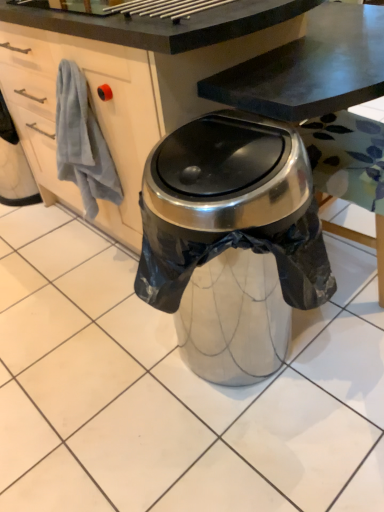
Question: Should I look upward or downward to see white matte cabinet at left?

Choices:
 (A) up
 (B) down

Answer: (A)

Question: Would you say white matte cabinet at left contains metallic trash can at center?

Choices:
 (A) yes
 (B) no

Answer: (B)

Question: Can you confirm if white matte cabinet at left is positioned to the right of metallic trash can at center?

Choices:
 (A) yes
 (B) no

Answer: (B)

Question: From a real-world perspective, is white matte cabinet at left beneath metallic trash can at center?

Choices:
 (A) yes
 (B) no

Answer: (B)

Question: Can you confirm if white matte cabinet at left is taller than metallic trash can at center?

Choices:
 (A) no
 (B) yes

Answer: (A)

Question: Is white matte cabinet at left shorter than metallic trash can at center?

Choices:
 (A) no
 (B) yes

Answer: (B)

Question: Is white matte cabinet at left aimed at metallic trash can at center?

Choices:
 (A) yes
 (B) no

Answer: (B)

Question: From the image's perspective, does metallic trash can at center appear lower than white matte cabinet at left?

Choices:
 (A) no
 (B) yes

Answer: (B)

Question: Would you say metallic trash can at center is outside white matte cabinet at left?

Choices:
 (A) yes
 (B) no

Answer: (A)

Question: Considering the relative sizes of metallic trash can at center and white matte cabinet at left in the image provided, is metallic trash can at center taller than white matte cabinet at left?

Choices:
 (A) yes
 (B) no

Answer: (A)

Question: From the image's perspective, is metallic trash can at center over white matte cabinet at left?

Choices:
 (A) no
 (B) yes

Answer: (A)

Question: From a real-world perspective, is metallic trash can at center located beneath white matte cabinet at left?

Choices:
 (A) yes
 (B) no

Answer: (A)

Question: Is metallic trash can at center bigger than white matte cabinet at left?

Choices:
 (A) yes
 (B) no

Answer: (A)

Question: Considering the relative positions of metallic trash can at center and white matte cabinet at left in the image provided, is metallic trash can at center to the left or to the right of white matte cabinet at left?

Choices:
 (A) right
 (B) left

Answer: (A)